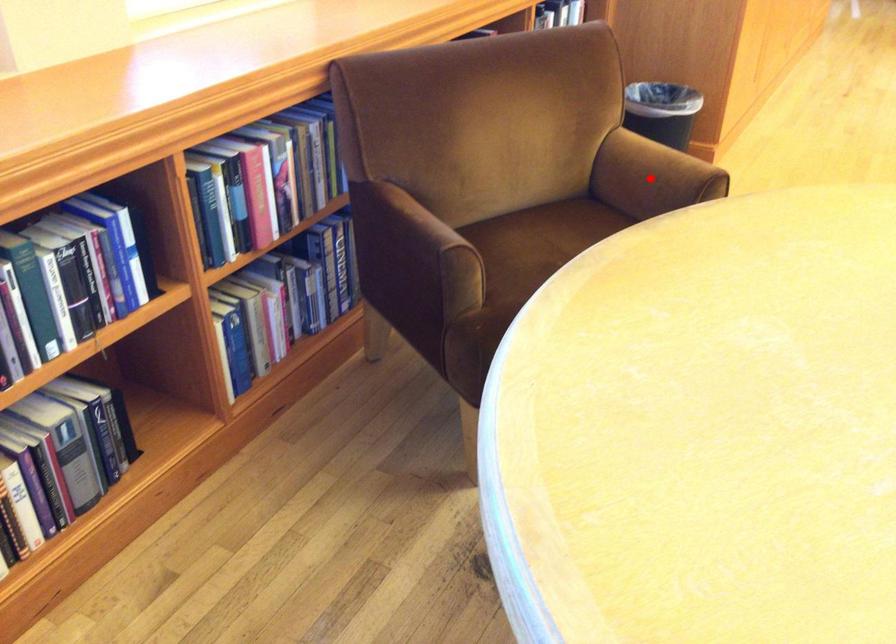
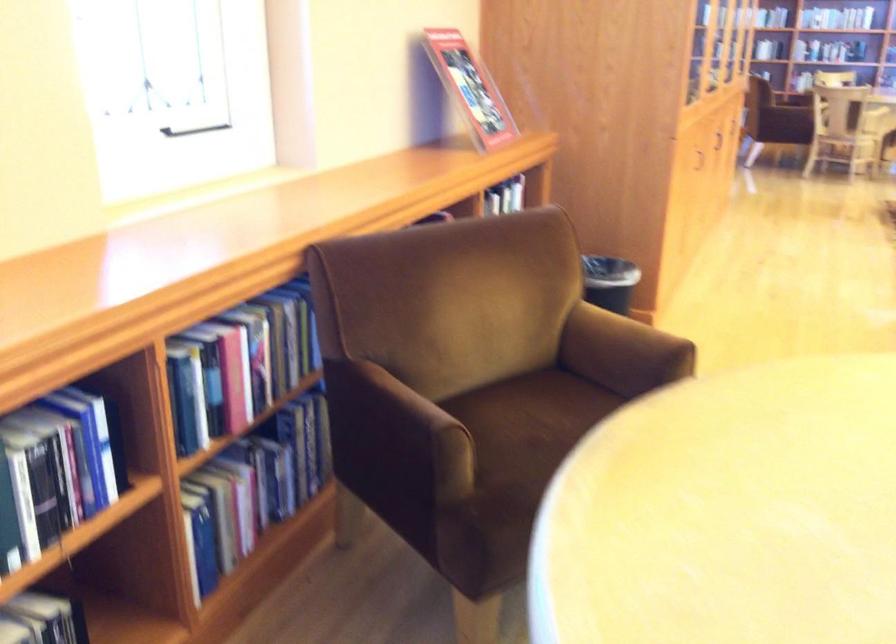
Where in the second image is the point corresponding to the highlighted location from the first image?

(622, 352)